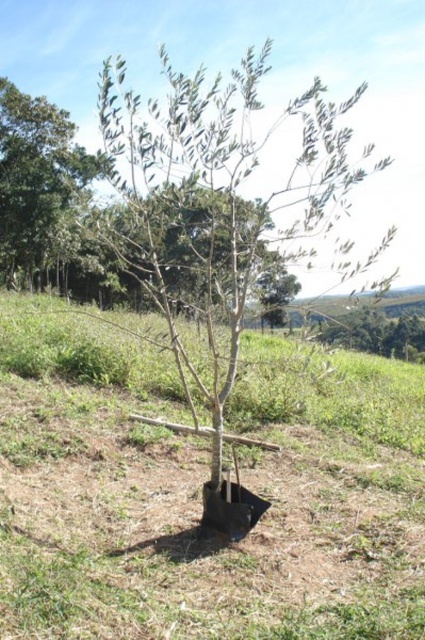
Between green matte tree at center and green leafy tree at upper left, which one appears on the right side from the viewer's perspective?

green matte tree at center

Is green matte tree at center smaller than green leafy tree at upper left?

Incorrect, green matte tree at center is not smaller in size than green leafy tree at upper left.

Who is more forward, (187, 129) or (70, 138)?

Point (187, 129) is more forward.

Where is `green matte tree at center`? The height and width of the screenshot is (640, 425). green matte tree at center is located at coordinates (215, 200).

Can you confirm if green grass at center is shorter than green leafy tree at upper left?

Yes, green grass at center is shorter than green leafy tree at upper left.

Is point (37, 300) positioned behind point (50, 211)?

No, it is not.

Does point (331, 624) come farther from viewer compared to point (8, 118)?

No, (331, 624) is closer to viewer.

You are a GUI agent. You are given a task and a screenshot of the screen. Output one action in this format:
    pyautogui.click(x=<x>, y=<y>)
    Task: Click on the green grass at center
    The image size is (425, 640).
    Given the screenshot: What is the action you would take?
    pyautogui.click(x=201, y=490)

Can you confirm if green grass at center is smaller than green matte tree at center?

Yes.

Does green grass at center appear under green matte tree at center?

Yes.

Which is behind, point (289, 426) or point (135, 99)?

Point (289, 426)

This screenshot has width=425, height=640. What are the coordinates of `green grass at center` in the screenshot? It's located at (201, 490).